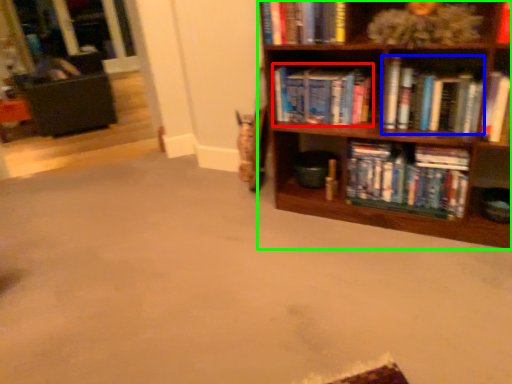
Question: Based on their relative distances, which object is farther from book (highlighted by a red box)? Choose from book (highlighted by a blue box) and bookcase (highlighted by a green box).

Choices:
 (A) book
 (B) bookcase

Answer: (A)